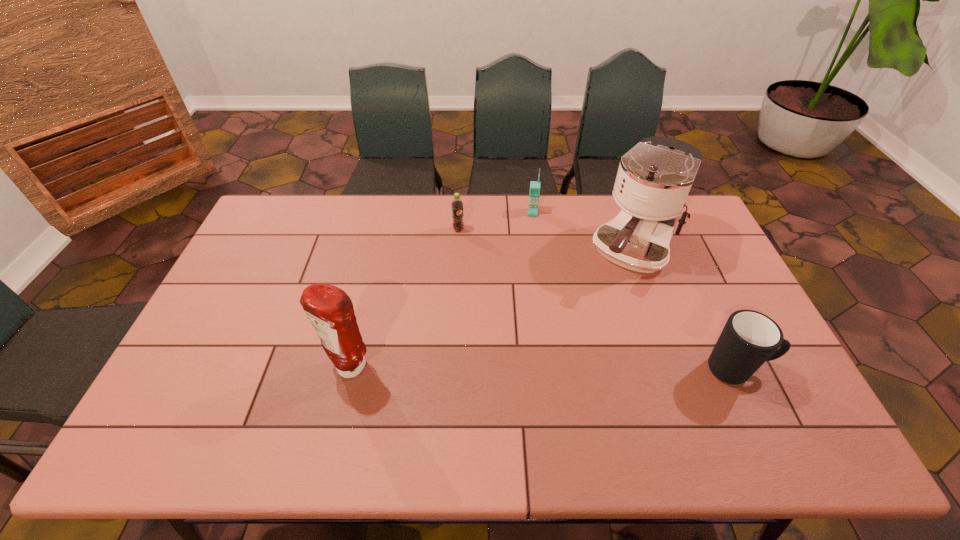
I want to click on cellular telephone at the far edge, so click(x=534, y=193).

Where is `condiment located in the near edge section of the desktop`? This screenshot has height=540, width=960. condiment located in the near edge section of the desktop is located at coordinates (330, 310).

In order to click on mug at the near edge in this screenshot , I will do `click(749, 338)`.

Where is `mug located at the right edge`? This screenshot has width=960, height=540. mug located at the right edge is located at coordinates (749, 338).

The image size is (960, 540). Find the location of `coffee maker that is at the right edge`. coffee maker that is at the right edge is located at coordinates (654, 178).

The height and width of the screenshot is (540, 960). Find the location of `object positioned at the far right corner`. object positioned at the far right corner is located at coordinates (654, 178).

This screenshot has height=540, width=960. I want to click on object present at the near right corner, so click(749, 338).

At what (x,y) coordinates should I click in order to perform the action: click on vacant region at the far edge of the desktop. Please return your answer as a coordinate pair (x, y). The height and width of the screenshot is (540, 960). Looking at the image, I should click on (613, 202).

In the image, there is a desktop. Identify the location of vacant space at the near edge. (695, 402).

Identify the location of free space at the left edge of the desktop. (243, 268).